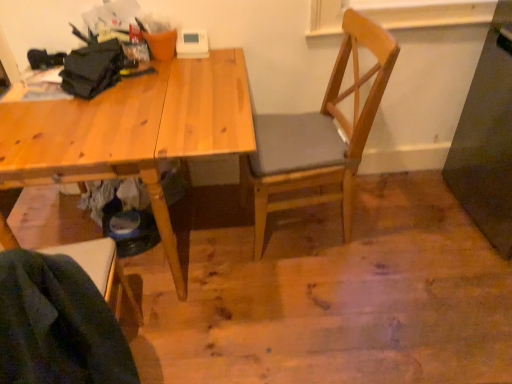
Question: Is wooden chair at lower left, the first chair positioned from the left, taller than wooden chair at center, acting as the 2th chair starting from the left?

Choices:
 (A) no
 (B) yes

Answer: (A)

Question: From the image's perspective, is wooden chair at lower left, the first chair in the front-to-back sequence, located above wooden chair at center, the 2th chair from the front?

Choices:
 (A) yes
 (B) no

Answer: (B)

Question: Is wooden chair at lower left, which is the 2th chair in back-to-front order, oriented towards wooden chair at center, arranged as the 1th chair when viewed from the back?

Choices:
 (A) yes
 (B) no

Answer: (B)

Question: Is wooden chair at lower left, which is the 2th chair in back-to-front order, closer to the viewer compared to wooden chair at center, acting as the 2th chair starting from the left?

Choices:
 (A) yes
 (B) no

Answer: (A)

Question: Can you confirm if wooden chair at lower left, the first chair positioned from the left, is bigger than wooden chair at center, placed as the 1th chair when sorted from right to left?

Choices:
 (A) no
 (B) yes

Answer: (A)

Question: Looking at their shapes, would you say wooden chair at lower left, acting as the second chair starting from the right, is wider or thinner than wooden chair at center, acting as the 2th chair starting from the left?

Choices:
 (A) thin
 (B) wide

Answer: (A)

Question: From the image's perspective, is wooden chair at lower left, which is the 2th chair in back-to-front order, above or below wooden chair at center, placed as the 1th chair when sorted from right to left?

Choices:
 (A) below
 (B) above

Answer: (A)

Question: Is wooden chair at lower left, the first chair in the front-to-back sequence, situated inside wooden chair at center, placed as the 1th chair when sorted from right to left, or outside?

Choices:
 (A) outside
 (B) inside

Answer: (A)

Question: Is wooden chair at lower left, acting as the second chair starting from the right, in front of or behind wooden chair at center, acting as the 2th chair starting from the left, in the image?

Choices:
 (A) behind
 (B) front

Answer: (B)

Question: From the image's perspective, relative to wooden chair at lower left, which is the 2th chair in back-to-front order, is natural wood desk at upper left above or below?

Choices:
 (A) below
 (B) above

Answer: (B)

Question: Considering the positions of natural wood desk at upper left and wooden chair at lower left, acting as the second chair starting from the right, in the image, is natural wood desk at upper left taller or shorter than wooden chair at lower left, acting as the second chair starting from the right,?

Choices:
 (A) tall
 (B) short

Answer: (A)

Question: Is point (175, 89) closer or farther from the camera than point (96, 258)?

Choices:
 (A) farther
 (B) closer

Answer: (A)

Question: From a real-world perspective, is natural wood desk at upper left above or below wooden chair at lower left, which is the 2th chair in back-to-front order?

Choices:
 (A) above
 (B) below

Answer: (B)

Question: Looking at the image, does wooden chair at center, arranged as the 1th chair when viewed from the back, seem bigger or smaller compared to wooden chair at lower left, the first chair in the front-to-back sequence?

Choices:
 (A) small
 (B) big

Answer: (B)

Question: From a real-world perspective, is wooden chair at center, acting as the 2th chair starting from the left, positioned above or below wooden chair at lower left, which is the 2th chair in back-to-front order?

Choices:
 (A) below
 (B) above

Answer: (A)